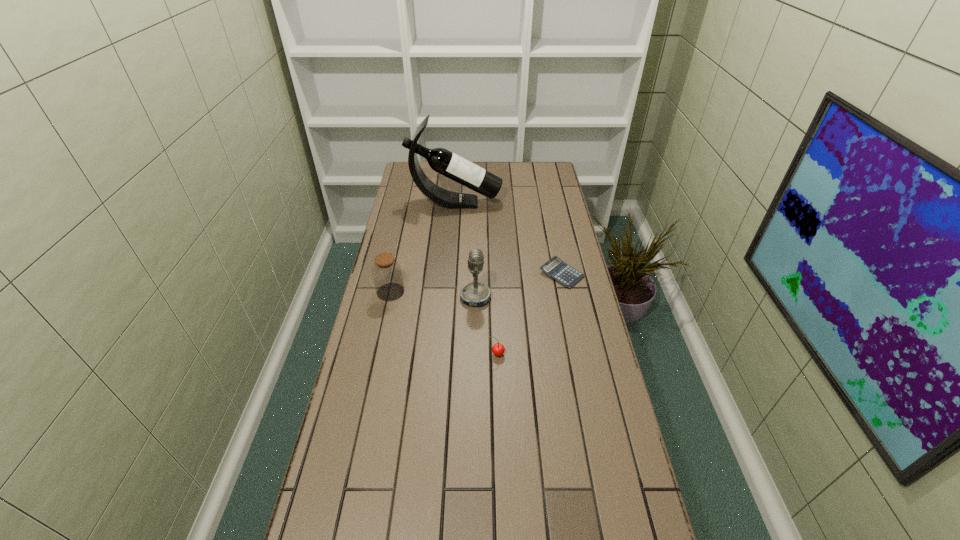
In the image, there is a desktop. Where is `vacant space at the far right corner`? vacant space at the far right corner is located at coordinates coord(535,177).

In order to click on blank region between the fourth shortest object and the second shortest object in this screenshot , I will do `click(486, 326)`.

Find the location of `vacant area that lies between the third tallest object and the cherry`. vacant area that lies between the third tallest object and the cherry is located at coordinates (444, 323).

The height and width of the screenshot is (540, 960). Identify the location of vacant area that lies between the farthest object and the microphone. (466, 250).

Where is `vacant region between the nearest object and the third tallest object`? The height and width of the screenshot is (540, 960). vacant region between the nearest object and the third tallest object is located at coordinates (444, 323).

Where is `vacant area that lies between the rightmost object and the fourth shortest object`? This screenshot has height=540, width=960. vacant area that lies between the rightmost object and the fourth shortest object is located at coordinates (518, 286).

The image size is (960, 540). I want to click on free space between the nearest object and the shortest object, so click(x=529, y=314).

Where is `vacant space in between the jar and the second shortest object`? This screenshot has width=960, height=540. vacant space in between the jar and the second shortest object is located at coordinates (444, 323).

This screenshot has height=540, width=960. Identify the location of object that stands as the third closest to the third shortest object. (441, 160).

At what (x,y) coordinates should I click in order to perform the action: click on object that is the fourth nearest to the microphone. Please return your answer as a coordinate pair (x, y). Image resolution: width=960 pixels, height=540 pixels. Looking at the image, I should click on (441, 160).